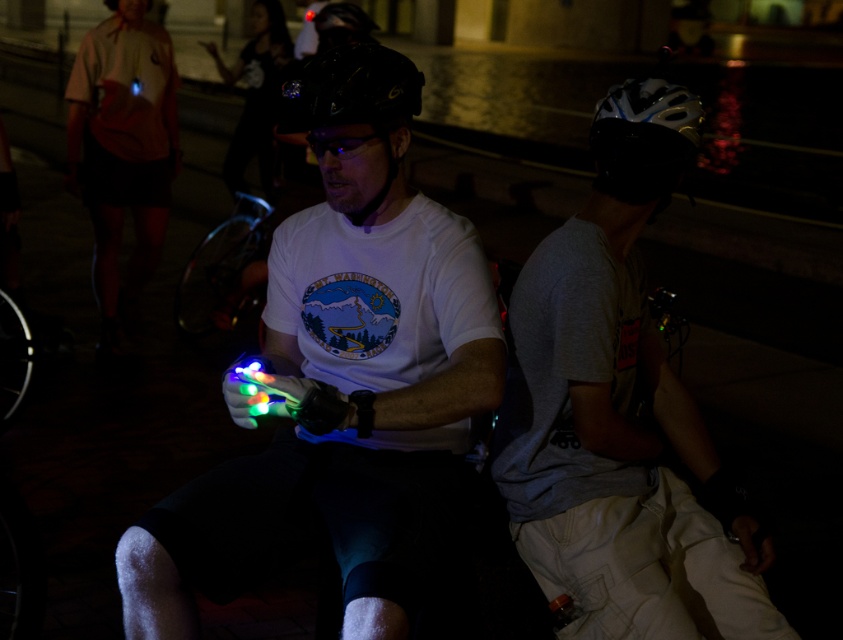
You are at an outdoor event and see the matte orange shirt at upper left and the white matte bicycle helmet at upper right. Which object is positioned further to the left?

The matte orange shirt at upper left is positioned further to the left compared to the white matte bicycle helmet at upper right.